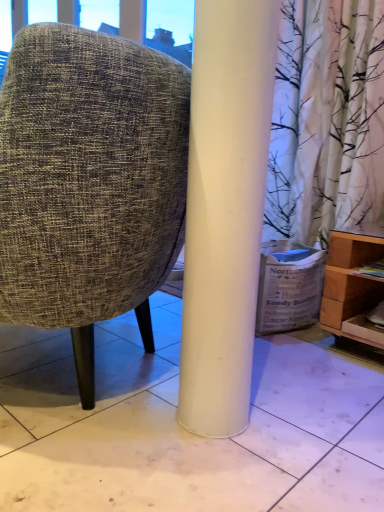
What is the approximate height of white cardboard box at lower right?

The height of white cardboard box at lower right is 29.91 centimeters.

Measure the distance between point (116, 465) and camera.

A distance of 33.62 inches exists between point (116, 465) and camera.

Find the location of a particular element. This screenshot has width=384, height=512. textured fabric chair at center is located at coordinates (89, 182).

Is point (181, 165) positioned behind point (350, 282)?

No, (181, 165) is in front of (350, 282).

Is textured fabric chair at center looking in the opposite direction of light brown wooden shelf at lower right?

Absolutely, textured fabric chair at center is directed away from light brown wooden shelf at lower right.

Is the depth of textured fabric chair at center less than that of light brown wooden shelf at lower right?

Yes, textured fabric chair at center is closer to the viewer.

From a real-world perspective, between textured fabric chair at center and light brown wooden shelf at lower right, who is vertically lower?

light brown wooden shelf at lower right, from a real-world perspective.

From the image's perspective, would you say white glossy tile at center is positioned over light brown wooden shelf at lower right?

No.

Would you say white glossy tile at center is to the left or to the right of light brown wooden shelf at lower right in the picture?

Clearly, white glossy tile at center is on the left of light brown wooden shelf at lower right in the image.

Who is shorter, white glossy tile at center or light brown wooden shelf at lower right?

Standing shorter between the two is white glossy tile at center.

Considering the positions of objects white cardboard box at lower right and textured fabric chair at center in the image provided, who is more to the left, white cardboard box at lower right or textured fabric chair at center?

Positioned to the left is textured fabric chair at center.

In terms of size, does white cardboard box at lower right appear bigger or smaller than textured fabric chair at center?

In the image, white cardboard box at lower right appears to be smaller than textured fabric chair at center.

Who is taller, white cardboard box at lower right or textured fabric chair at center?

textured fabric chair at center.

What's the angular difference between white cardboard box at lower right and textured fabric chair at center's facing directions?

53 degrees separate the facing orientations of white cardboard box at lower right and textured fabric chair at center.

From the image's perspective, relative to textured fabric chair at center, is white glossy tile at center above or below?

white glossy tile at center is below textured fabric chair at center.

Considering the positions of objects white glossy tile at center and textured fabric chair at center in the image provided, who is more to the right, white glossy tile at center or textured fabric chair at center?

white glossy tile at center is more to the right.

Considering the relative sizes of white glossy tile at center and textured fabric chair at center in the image provided, is white glossy tile at center taller than textured fabric chair at center?

In fact, white glossy tile at center may be shorter than textured fabric chair at center.

Is light brown wooden shelf at lower right with textured fabric chair at center?

light brown wooden shelf at lower right is not next to textured fabric chair at center, and they're not touching.

Considering the sizes of objects light brown wooden shelf at lower right and textured fabric chair at center in the image provided, who is wider, light brown wooden shelf at lower right or textured fabric chair at center?

With larger width is light brown wooden shelf at lower right.

From a real-world perspective, which is physically above, light brown wooden shelf at lower right or textured fabric chair at center?

textured fabric chair at center.

Is light brown wooden shelf at lower right turned away from textured fabric chair at center?

No, light brown wooden shelf at lower right is not facing away from textured fabric chair at center.

Who is taller, textured fabric chair at center or white cardboard box at lower right?

textured fabric chair at center.

How far apart are textured fabric chair at center and white cardboard box at lower right?

textured fabric chair at center is 27.58 inches away from white cardboard box at lower right.

From a real-world perspective, does textured fabric chair at center stand above white cardboard box at lower right?

Yes, from a real-world perspective, textured fabric chair at center is on top of white cardboard box at lower right.

Which object is more forward, textured fabric chair at center or white cardboard box at lower right?

Positioned in front is textured fabric chair at center.

In the scene shown: Are light brown wooden shelf at lower right and white glossy tile at center located far from each other?

No, light brown wooden shelf at lower right is not far from white glossy tile at center.

Who is shorter, light brown wooden shelf at lower right or white glossy tile at center?

white glossy tile at center is shorter.

Does light brown wooden shelf at lower right have a smaller size compared to white glossy tile at center?

Yes, light brown wooden shelf at lower right is smaller than white glossy tile at center.

Considering the positions of objects light brown wooden shelf at lower right and white glossy tile at center in the image provided, who is more to the left, light brown wooden shelf at lower right or white glossy tile at center?

white glossy tile at center.

Identify the location of shelf located behind the textured fabric chair at center. This screenshot has height=512, width=384. (350, 281).

This screenshot has width=384, height=512. In order to click on tile that is in front of the light brown wooden shelf at lower right in this screenshot , I will do `click(182, 428)`.

From the image, which object appears to be nearer to light brown wooden shelf at lower right, textured fabric chair at center or white glossy tile at center?

white glossy tile at center is positioned closer to the anchor light brown wooden shelf at lower right.

From the image, which object appears to be nearer to light brown wooden shelf at lower right, white glossy tile at center or textured fabric chair at center?

white glossy tile at center lies closer to light brown wooden shelf at lower right than the other object.

Considering their positions, is white glossy tile at center positioned closer to white cardboard box at lower right than light brown wooden shelf at lower right?

Among the two, light brown wooden shelf at lower right is located nearer to white cardboard box at lower right.

When comparing their distances from light brown wooden shelf at lower right, does white glossy tile at center or white cardboard box at lower right seem closer?

white cardboard box at lower right is positioned closer to the anchor light brown wooden shelf at lower right.

Estimate the real-world distances between objects in this image. Which object is closer to light brown wooden shelf at lower right, white cardboard box at lower right or white glossy tile at center?

white cardboard box at lower right is positioned closer to the anchor light brown wooden shelf at lower right.

From the image, which object appears to be nearer to white glossy tile at center, light brown wooden shelf at lower right or white cardboard box at lower right?

white cardboard box at lower right is closer to white glossy tile at center.

Considering their positions, is white cardboard box at lower right positioned closer to textured fabric chair at center than light brown wooden shelf at lower right?

The object closer to textured fabric chair at center is white cardboard box at lower right.

Considering their positions, is white glossy tile at center positioned further to white cardboard box at lower right than textured fabric chair at center?

Based on the image, textured fabric chair at center appears to be further to white cardboard box at lower right.

The height and width of the screenshot is (512, 384). I want to click on cardboard box between textured fabric chair at center and light brown wooden shelf at lower right in the horizontal direction, so click(288, 286).

Find the location of a particular element. The image size is (384, 512). chair between white glossy tile at center and white cardboard box at lower right from front to back is located at coordinates (89, 182).

At what (x,y) coordinates should I click in order to perform the action: click on shelf between white glossy tile at center and white cardboard box at lower right in the front-back direction. Please return your answer as a coordinate pair (x, y). Looking at the image, I should click on (350, 281).

The image size is (384, 512). I want to click on tile situated between textured fabric chair at center and light brown wooden shelf at lower right from left to right, so click(182, 428).